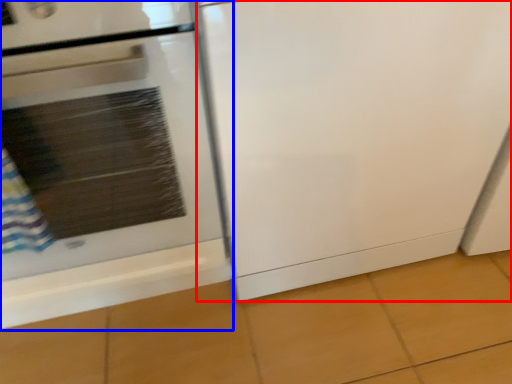
Question: Which object is closer to the camera taking this photo, screen door (highlighted by a red box) or home appliance (highlighted by a blue box)?

Choices:
 (A) screen door
 (B) home appliance

Answer: (B)